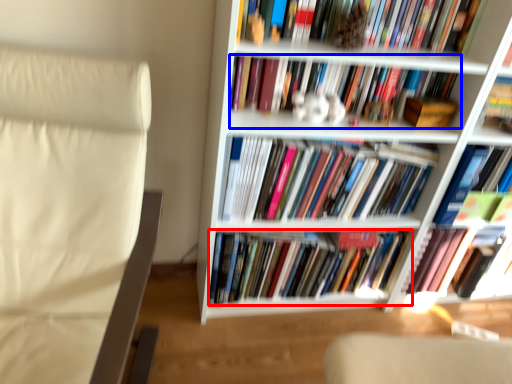
Question: Which object appears closest to the camera in this image, book (highlighted by a red box) or book (highlighted by a blue box)?

Choices:
 (A) book
 (B) book

Answer: (B)